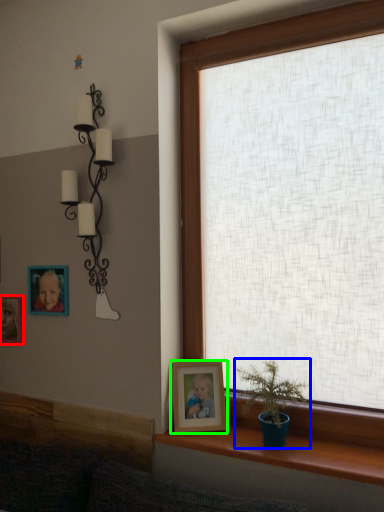
Question: Considering the real-world distances, which object is farthest from picture frame (highlighted by a red box)? houseplant (highlighted by a blue box) or picture frame (highlighted by a green box)?

Choices:
 (A) houseplant
 (B) picture frame

Answer: (A)